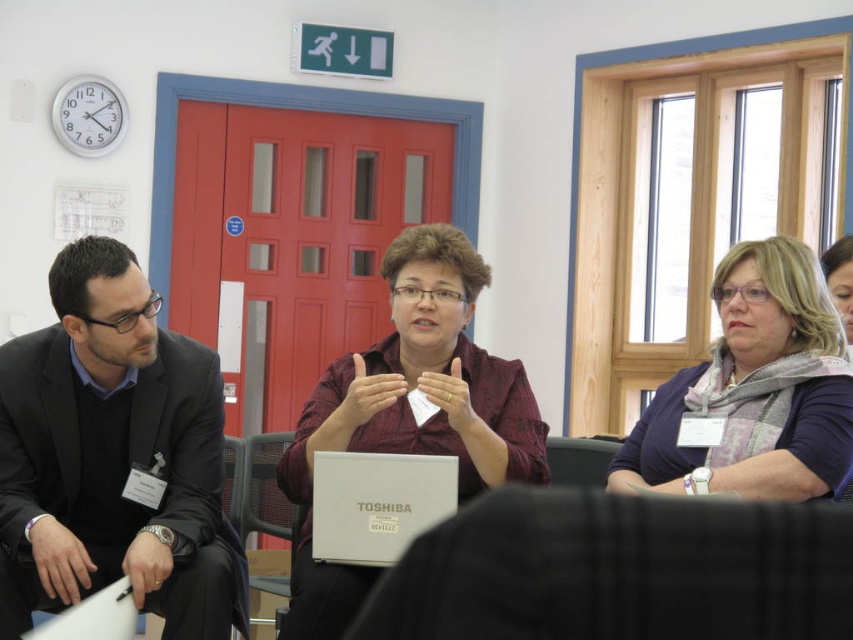
Can you confirm if maroon fabric shirt at center is positioned to the left of metallic gray chair at center?

In fact, maroon fabric shirt at center is to the right of metallic gray chair at center.

Locate an element on the screen. The image size is (853, 640). maroon fabric shirt at center is located at coordinates (425, 380).

This screenshot has width=853, height=640. Describe the element at coordinates (113, 458) in the screenshot. I see `black suit at left` at that location.

Who is shorter, black suit at left or matte purple scarf at upper right?

Standing shorter between the two is matte purple scarf at upper right.

Measure the distance between black suit at left and camera.

black suit at left and camera are 8.27 feet apart.

Identify the location of black suit at left. (113, 458).

Is black suit at left bigger than silver metallic laptop at center?

Yes.

Between black suit at left and silver metallic laptop at center, which one appears on the right side from the viewer's perspective?

silver metallic laptop at center is more to the right.

Measure the distance between point (201, 564) and camera.

The distance of point (201, 564) from camera is 2.78 meters.

Locate an element on the screen. Image resolution: width=853 pixels, height=640 pixels. black suit at left is located at coordinates (113, 458).